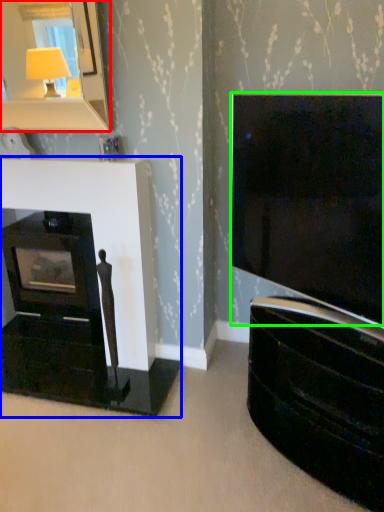
Question: Which is nearer to the mirror (highlighted by a red box)? fireplace (highlighted by a blue box) or television (highlighted by a green box).

Choices:
 (A) fireplace
 (B) television

Answer: (A)